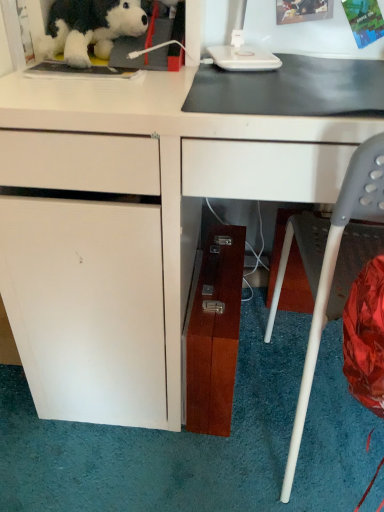
Question: Is white matte desk at center behind fluffy plush dog at upper left?

Choices:
 (A) no
 (B) yes

Answer: (A)

Question: Does white matte desk at center have a greater width compared to fluffy plush dog at upper left?

Choices:
 (A) yes
 (B) no

Answer: (A)

Question: Is fluffy plush dog at upper left at the back of white matte desk at center?

Choices:
 (A) no
 (B) yes

Answer: (A)

Question: From the image's perspective, is white matte desk at center below fluffy plush dog at upper left?

Choices:
 (A) yes
 (B) no

Answer: (A)

Question: Is white matte desk at center positioned far away from fluffy plush dog at upper left?

Choices:
 (A) no
 (B) yes

Answer: (A)

Question: In the image, is white matte desk at center positioned in front of or behind wooden file cabinet at lower center?

Choices:
 (A) front
 (B) behind

Answer: (A)

Question: Visually, is white matte desk at center positioned to the left or to the right of wooden file cabinet at lower center?

Choices:
 (A) right
 (B) left

Answer: (A)

Question: Is white matte desk at center taller or shorter than wooden file cabinet at lower center?

Choices:
 (A) tall
 (B) short

Answer: (A)

Question: Do you think white matte desk at center is within wooden file cabinet at lower center, or outside of it?

Choices:
 (A) outside
 (B) inside

Answer: (A)

Question: Is gray plastic chair at lower right wider or thinner than fluffy plush dog at upper left?

Choices:
 (A) wide
 (B) thin

Answer: (A)

Question: From the image's perspective, is gray plastic chair at lower right located above or below fluffy plush dog at upper left?

Choices:
 (A) below
 (B) above

Answer: (A)

Question: From a real-world perspective, is gray plastic chair at lower right physically located above or below fluffy plush dog at upper left?

Choices:
 (A) below
 (B) above

Answer: (A)

Question: Does point (326, 222) appear closer or farther from the camera than point (49, 15)?

Choices:
 (A) farther
 (B) closer

Answer: (A)

Question: Is point (87, 100) closer or farther from the camera than point (44, 54)?

Choices:
 (A) farther
 (B) closer

Answer: (B)

Question: Based on their positions, is white matte desk at center located to the left or right of fluffy plush dog at upper left?

Choices:
 (A) right
 (B) left

Answer: (A)